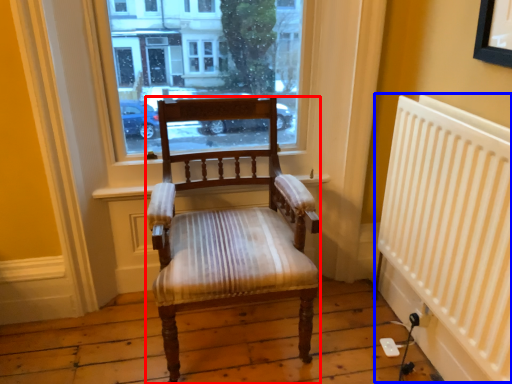
Question: Which object appears farthest to the camera in this image, chair (highlighted by a red box) or radiator (highlighted by a blue box)?

Choices:
 (A) chair
 (B) radiator

Answer: (A)